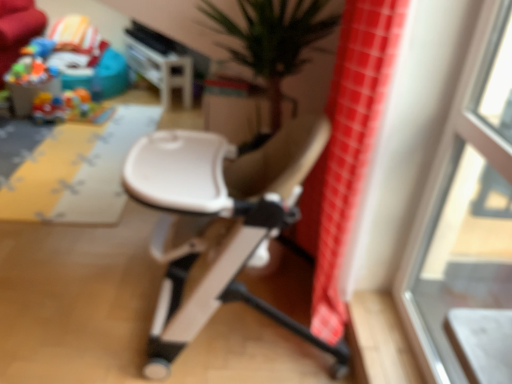
Question: Should I look upward or downward to see red checkered fabric at right?

Choices:
 (A) up
 (B) down

Answer: (A)

Question: Is white plastic chair at center looking in the opposite direction of transparent glass window at upper right?

Choices:
 (A) yes
 (B) no

Answer: (A)

Question: Considering the relative positions of white plastic chair at center and transparent glass window at upper right in the image provided, is white plastic chair at center to the left of transparent glass window at upper right from the viewer's perspective?

Choices:
 (A) yes
 (B) no

Answer: (A)

Question: Is white plastic chair at center directly adjacent to transparent glass window at upper right?

Choices:
 (A) yes
 (B) no

Answer: (B)

Question: Can you confirm if white plastic chair at center is taller than transparent glass window at upper right?

Choices:
 (A) yes
 (B) no

Answer: (B)

Question: Can transparent glass window at upper right be found inside white plastic chair at center?

Choices:
 (A) no
 (B) yes

Answer: (A)

Question: From the image's perspective, is white plastic chair at center beneath transparent glass window at upper right?

Choices:
 (A) yes
 (B) no

Answer: (A)

Question: Is red checkered fabric at right to the right of transparent glass window at upper right from the viewer's perspective?

Choices:
 (A) yes
 (B) no

Answer: (B)

Question: Is red checkered fabric at right aimed at transparent glass window at upper right?

Choices:
 (A) no
 (B) yes

Answer: (A)

Question: Is there a large distance between red checkered fabric at right and transparent glass window at upper right?

Choices:
 (A) no
 (B) yes

Answer: (A)

Question: Can you confirm if red checkered fabric at right is bigger than transparent glass window at upper right?

Choices:
 (A) yes
 (B) no

Answer: (A)

Question: Is red checkered fabric at right shorter than transparent glass window at upper right?

Choices:
 (A) yes
 (B) no

Answer: (B)

Question: Is red checkered fabric at right closer to the viewer compared to transparent glass window at upper right?

Choices:
 (A) yes
 (B) no

Answer: (B)

Question: Is the surface of plastic colorful toys at upper left in direct contact with white plastic chair at center?

Choices:
 (A) yes
 (B) no

Answer: (B)